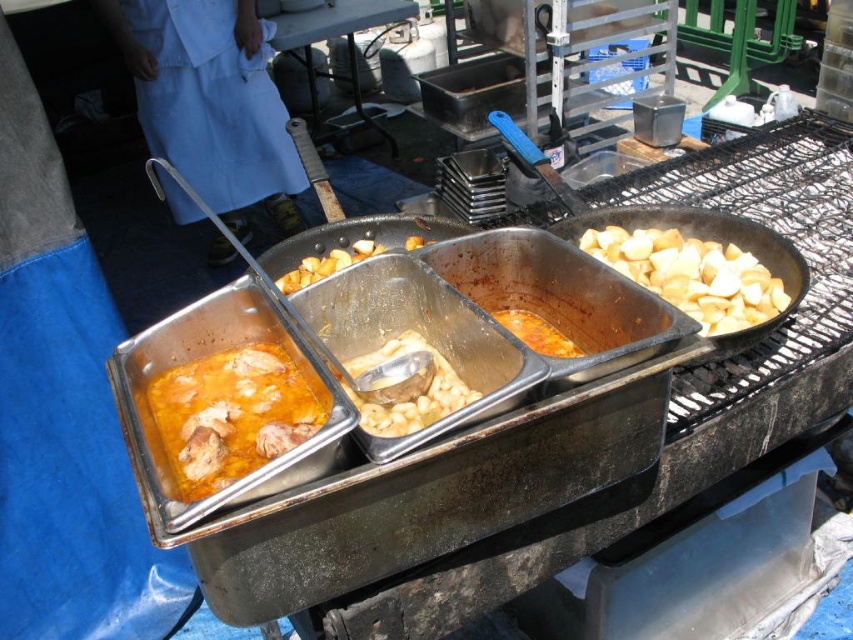
Question: Which point appears closest to the camera in this image?

Choices:
 (A) (x=514, y=333)
 (B) (x=306, y=268)
 (C) (x=714, y=308)

Answer: (A)

Question: Is golden brown potato at center smaller than orange matte stew at center?

Choices:
 (A) no
 (B) yes

Answer: (A)

Question: Is yellowish matte chicken stew at lower left closer to the viewer compared to yellowish matte potatoes at right?

Choices:
 (A) yes
 (B) no

Answer: (A)

Question: Does yellowish matte chicken stew at lower left appear under white matte beans at center?

Choices:
 (A) no
 (B) yes

Answer: (B)

Question: Which object is farther from the camera taking this photo?

Choices:
 (A) orange matte stew at center
 (B) white matte beans at center
 (C) yellowish matte potatoes at right
 (D) golden brown potato at center

Answer: (D)

Question: Which object appears farthest from the camera in this image?

Choices:
 (A) yellowish matte chicken stew at lower left
 (B) golden brown potato at center
 (C) orange matte stew at center

Answer: (B)